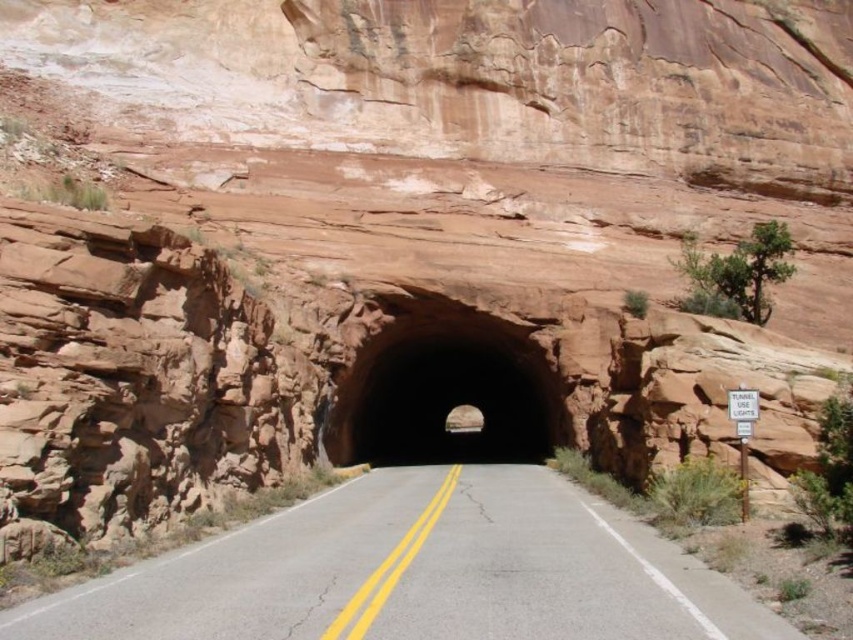
Does point (473, 486) come farther from viewer compared to point (462, 369)?

That is False.

From the picture: Which of these two, asphalt road at center or brown rock tunnel at center, stands shorter?

With less height is asphalt road at center.

Is point (585, 566) behind point (370, 364)?

No.

You are a GUI agent. You are given a task and a screenshot of the screen. Output one action in this format:
    pyautogui.click(x=<x>, y=<y>)
    Task: Click on the asphalt road at center
    The image size is (853, 640).
    Given the screenshot: What is the action you would take?
    pyautogui.click(x=416, y=572)